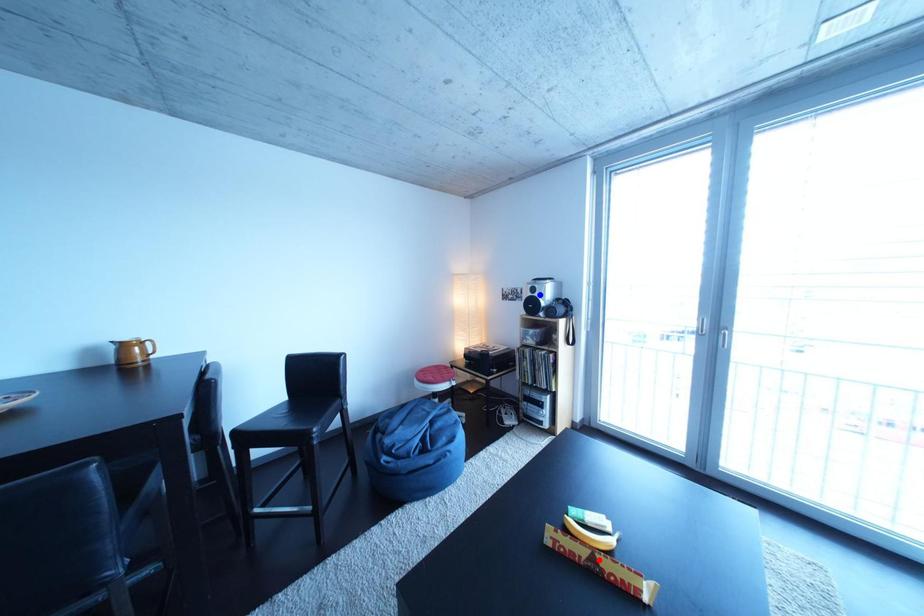
Question: In the image, two points are highlighted. Which point is nearer to the camera? Reply with the corresponding letter.

Choices:
 (A) blue point
 (B) red point

Answer: (B)